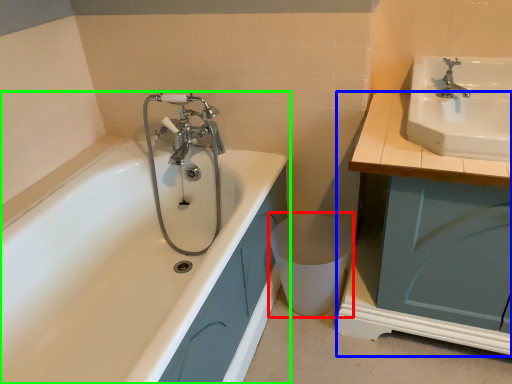
Question: Estimate the real-world distances between objects in this image. Which object is farther from toilet bowl (highlighted by a red box), cabinetry (highlighted by a blue box) or bathtub (highlighted by a green box)?

Choices:
 (A) cabinetry
 (B) bathtub

Answer: (A)